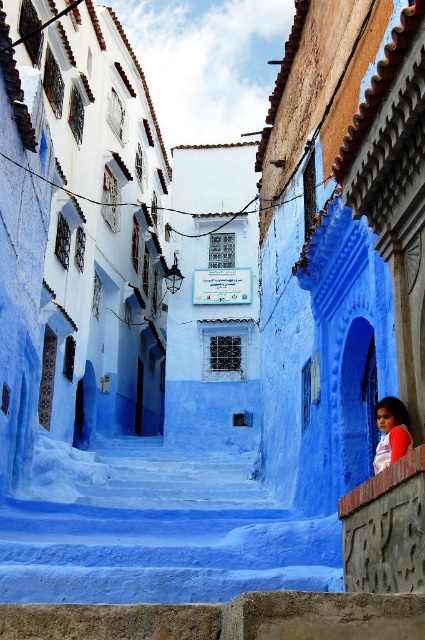
Question: Can you confirm if smooth plaster stairs at center is positioned to the left of matte red shirt at right?

Choices:
 (A) no
 (B) yes

Answer: (B)

Question: Does smooth plaster stairs at center have a larger size compared to matte red shirt at right?

Choices:
 (A) no
 (B) yes

Answer: (B)

Question: Is smooth plaster stairs at center thinner than matte red shirt at right?

Choices:
 (A) no
 (B) yes

Answer: (A)

Question: Among these points, which one is nearest to the camera?

Choices:
 (A) (376, 422)
 (B) (201, 467)

Answer: (A)

Question: Among these points, which one is nearest to the camera?

Choices:
 (A) (136, 461)
 (B) (380, 413)

Answer: (B)